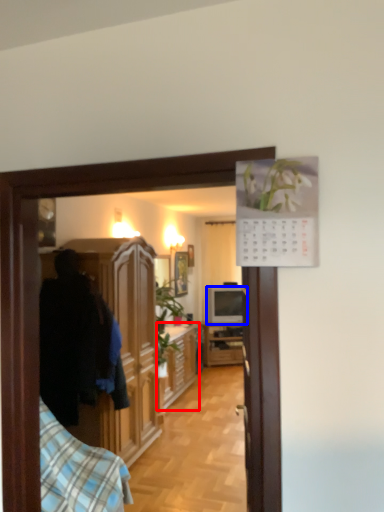
Question: Which object appears farthest to the camera in this image, cabinetry (highlighted by a red box) or television (highlighted by a blue box)?

Choices:
 (A) cabinetry
 (B) television

Answer: (B)